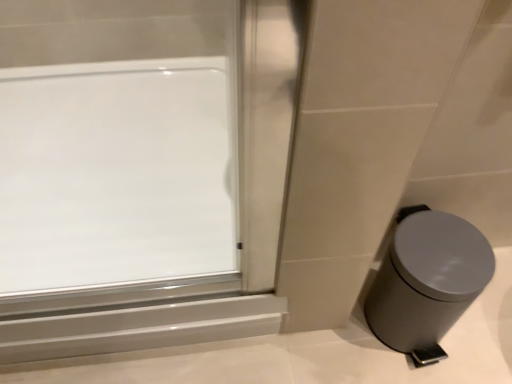
Question: Is point (414, 332) positioned closer to the camera than point (208, 208)?

Choices:
 (A) closer
 (B) farther

Answer: (A)

Question: From a real-world perspective, relative to transparent glass window at upper left, is gray matte waste container at lower right vertically above or below?

Choices:
 (A) above
 (B) below

Answer: (B)

Question: Considering their positions, is gray matte waste container at lower right located in front of or behind transparent glass window at upper left?

Choices:
 (A) behind
 (B) front

Answer: (B)

Question: Considering the positions of transparent glass window at upper left and gray matte waste container at lower right in the image, is transparent glass window at upper left taller or shorter than gray matte waste container at lower right?

Choices:
 (A) tall
 (B) short

Answer: (B)

Question: From a real-world perspective, is transparent glass window at upper left positioned above or below gray matte waste container at lower right?

Choices:
 (A) above
 (B) below

Answer: (A)

Question: From the image's perspective, is transparent glass window at upper left above or below gray matte waste container at lower right?

Choices:
 (A) below
 (B) above

Answer: (B)

Question: In terms of size, does transparent glass window at upper left appear bigger or smaller than gray matte waste container at lower right?

Choices:
 (A) big
 (B) small

Answer: (A)